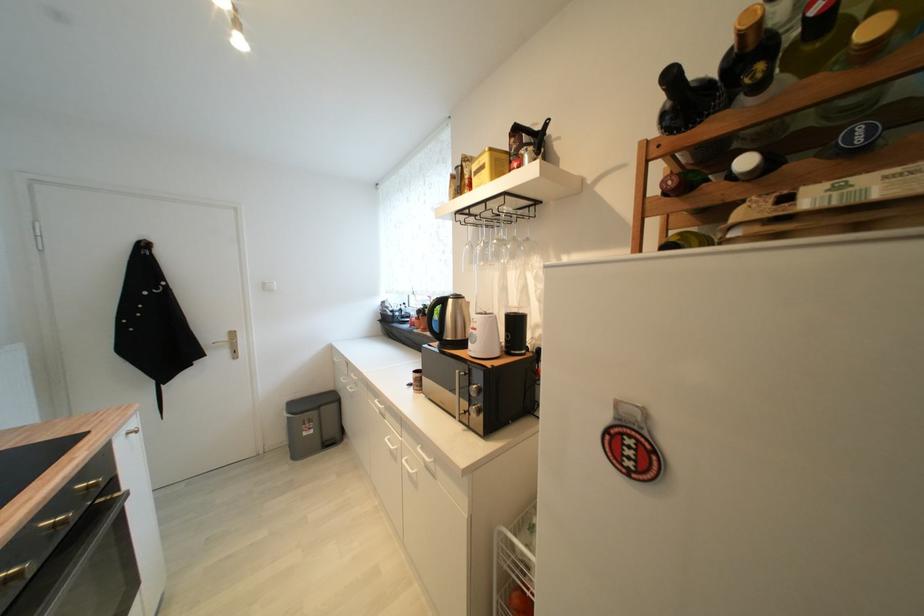
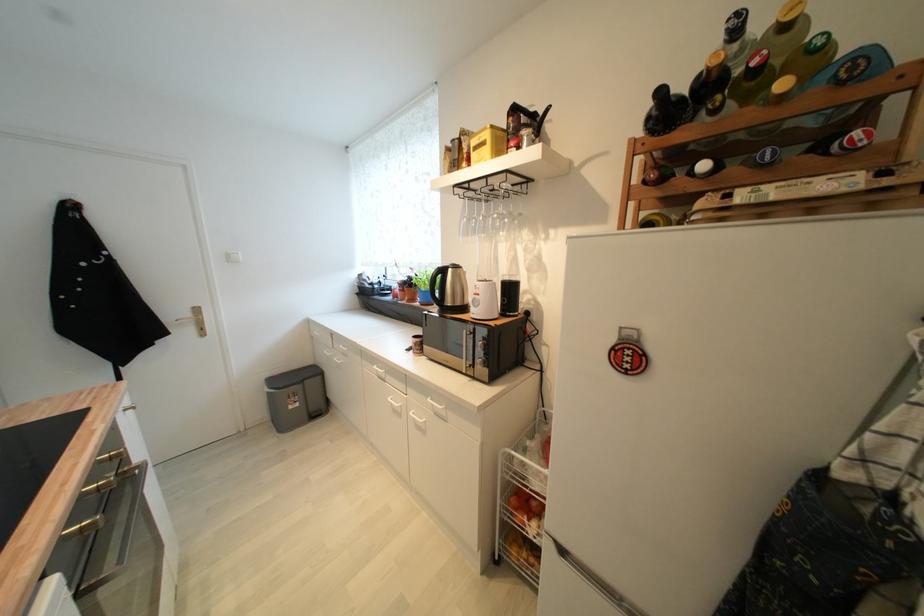
In the second image, find the point that corresponds to pixel 751 164 in the first image.

(709, 168)